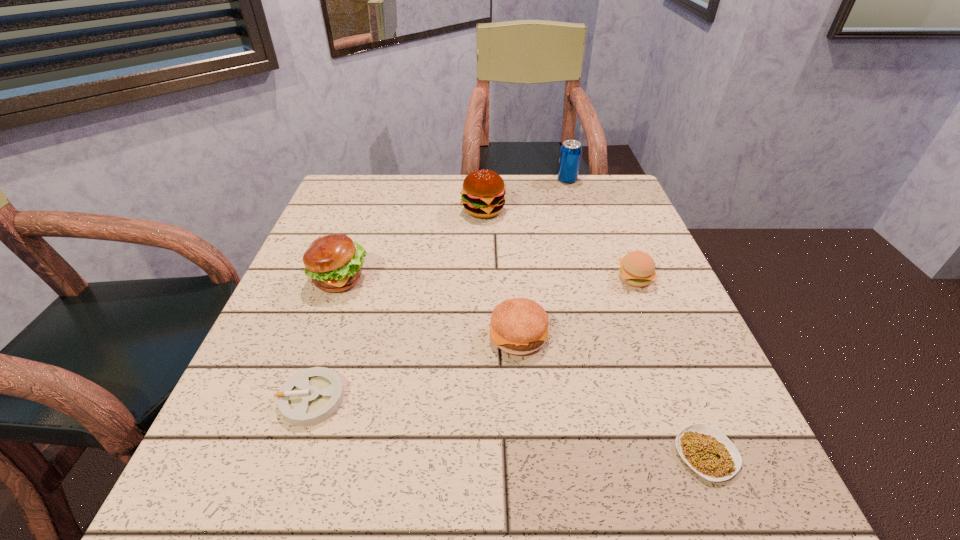
Where is `pop soda that is at the right edge`? This screenshot has height=540, width=960. pop soda that is at the right edge is located at coordinates (570, 153).

Identify the location of hamburger present at the right edge. (637, 268).

Where is `legume present at the right edge`? This screenshot has width=960, height=540. legume present at the right edge is located at coordinates (706, 450).

The height and width of the screenshot is (540, 960). What are the coordinates of `object situated at the far right corner` in the screenshot? It's located at (570, 153).

I want to click on object located at the near right corner, so click(706, 450).

Where is `free space at the far edge of the desktop`? free space at the far edge of the desktop is located at coordinates (409, 210).

The width and height of the screenshot is (960, 540). In the image, there is a desktop. In order to click on blank space at the near edge in this screenshot , I will do `click(418, 495)`.

At what (x,y) coordinates should I click in order to perform the action: click on free space at the left edge of the desktop. Please return your answer as a coordinate pair (x, y). Image resolution: width=960 pixels, height=540 pixels. Looking at the image, I should click on (370, 264).

Identify the location of free space at the right edge of the desktop. (600, 277).

Identify the location of free space between the rightmost hamburger and the leftmost hamburger. The height and width of the screenshot is (540, 960). (488, 278).